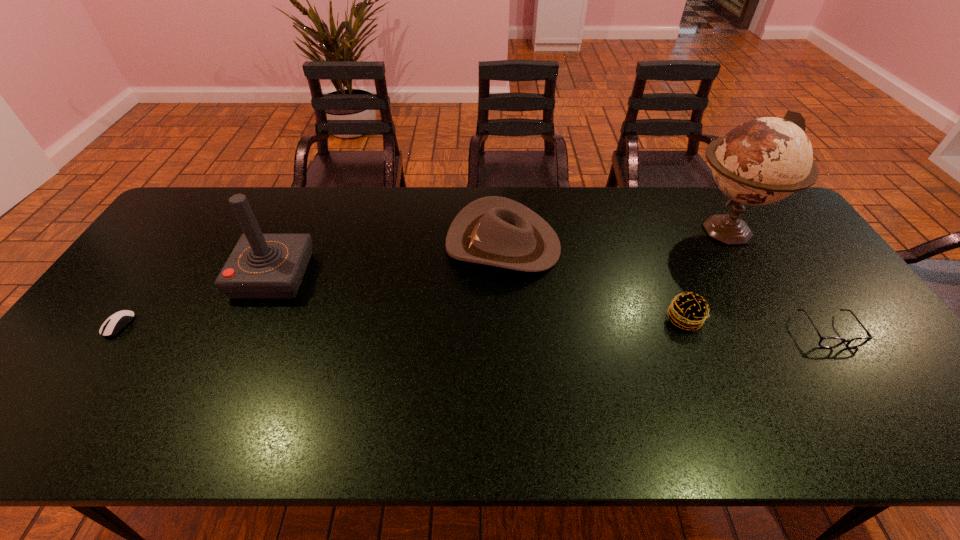
I want to click on vacant space situated on the front of the globe showing Asia, so click(607, 230).

At what (x,y) coordinates should I click in order to perform the action: click on vacant area located 0.100m on the front of the globe showing Asia. Please return your answer as a coordinate pair (x, y). The height and width of the screenshot is (540, 960). Looking at the image, I should click on (650, 230).

I want to click on free space located on the front of the globe showing Asia, so click(x=622, y=230).

The width and height of the screenshot is (960, 540). I want to click on vacant space located on the rectangular base of the fifth object from right to left, so [x=428, y=275].

Where is `blank space located with a star on the front of the fourth shortest object`? blank space located with a star on the front of the fourth shortest object is located at coordinates (337, 245).

Identify the location of vacant point located with a star on the front of the fourth shortest object. (388, 245).

Locate an element on the screen. vacant space located with a star on the front of the fourth shortest object is located at coordinates (417, 245).

At what (x,y) coordinates should I click in order to perform the action: click on free spot located on the front of the fourth tallest object. Please return your answer as a coordinate pair (x, y). The image size is (960, 540). Looking at the image, I should click on (725, 417).

The image size is (960, 540). Find the location of `vacant space located 0.200m on the front-facing side of the spectacles`. vacant space located 0.200m on the front-facing side of the spectacles is located at coordinates (893, 426).

I want to click on free region located on the back of the leftmost object, so click(173, 249).